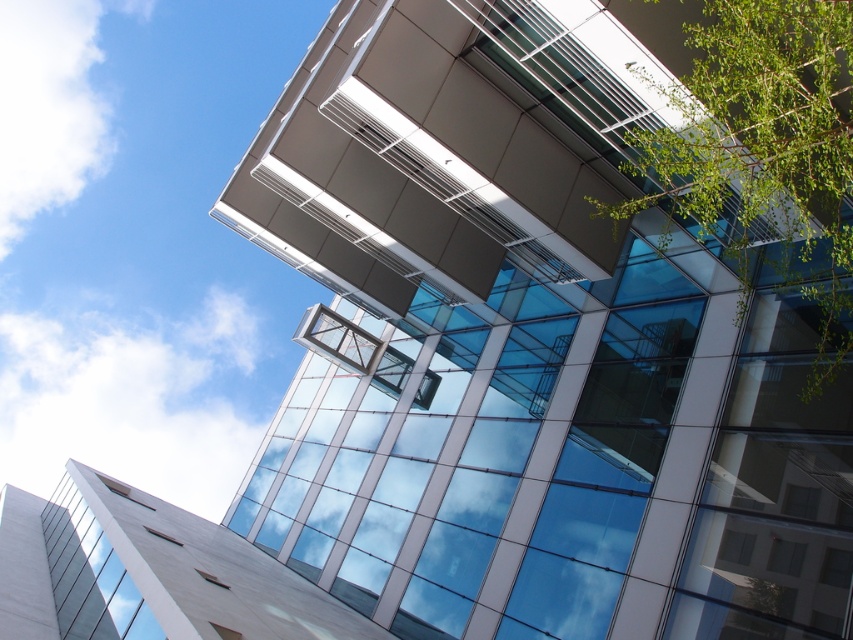
You are standing in front of the building and notice the green leafy tree at upper right and the transparent glass window at lower left. From your perspective, which object is positioned more to the right side of the building?

The green leafy tree at upper right is positioned more to the right side of the building than the transparent glass window at lower left.

From the picture: You are an architect analyzing the building design. You notice the green leafy tree at upper right and the transparent glass window at lower left. Which of these two elements takes up more visual space in the composition?

The transparent glass window at lower left occupies more visual space than the green leafy tree at upper right.

You are standing 10 feet away from the base of the building shown in the image. There is a point at coordinates point (810, 390) on the building. Can you reach this point with a ladder that extends up to 25 feet?

The distance of point (810, 390) from viewer is 30.87 feet. Since the ladder only extends up to 25 feet, you cannot reach the point with the ladder.